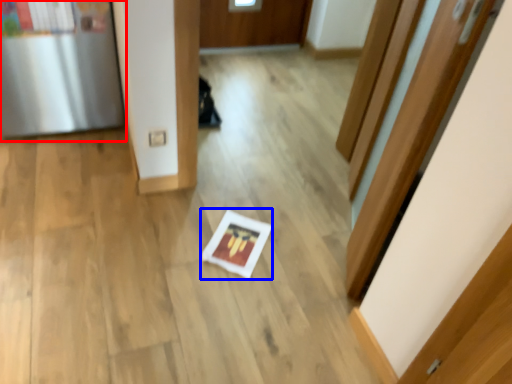
Question: Which object appears closest to the camera in this image, fridge (highlighted by a red box) or copy (highlighted by a blue box)?

Choices:
 (A) fridge
 (B) copy

Answer: (A)